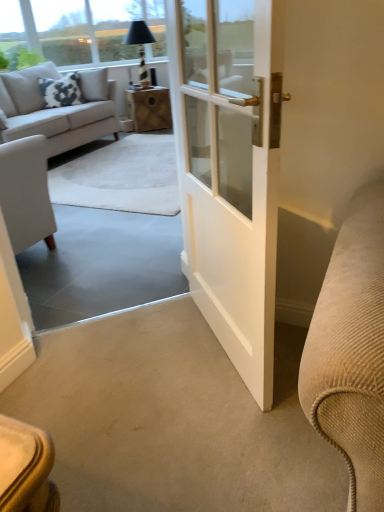
Question: From a real-world perspective, is black glass lamp at upper center physically located above or below transparent glass window screen at upper left?

Choices:
 (A) above
 (B) below

Answer: (B)

Question: From the image's perspective, is black glass lamp at upper center positioned above or below transparent glass window screen at upper left?

Choices:
 (A) below
 (B) above

Answer: (A)

Question: Which object is positioned farthest from the black glass lamp at upper center?

Choices:
 (A) light gray fabric couch at upper left
 (B) wooden box at center
 (C) white cotton pillow at upper left
 (D) transparent glass window screen at upper left

Answer: (A)

Question: Estimate the real-world distances between objects in this image. Which object is closer to the light gray fabric couch at upper left?

Choices:
 (A) white cotton pillow at upper left
 (B) wooden box at center
 (C) transparent glass window screen at upper left
 (D) black glass lamp at upper center

Answer: (A)